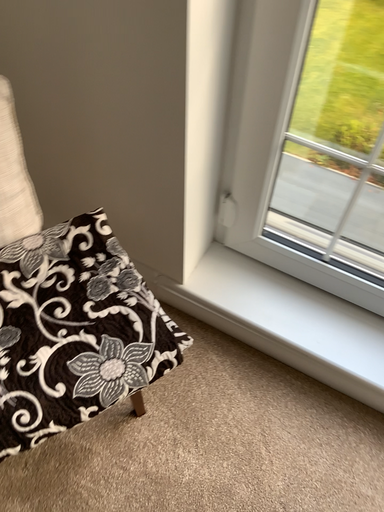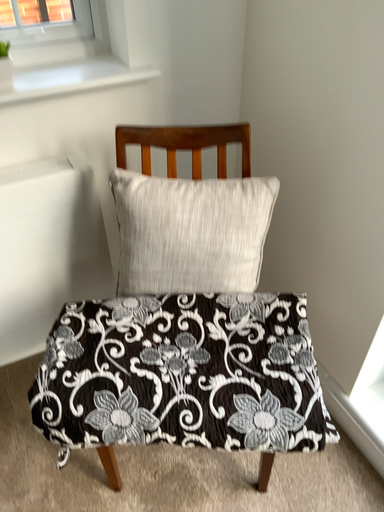
Question: Which way did the camera rotate in the video?

Choices:
 (A) rotated right
 (B) rotated left

Answer: (B)